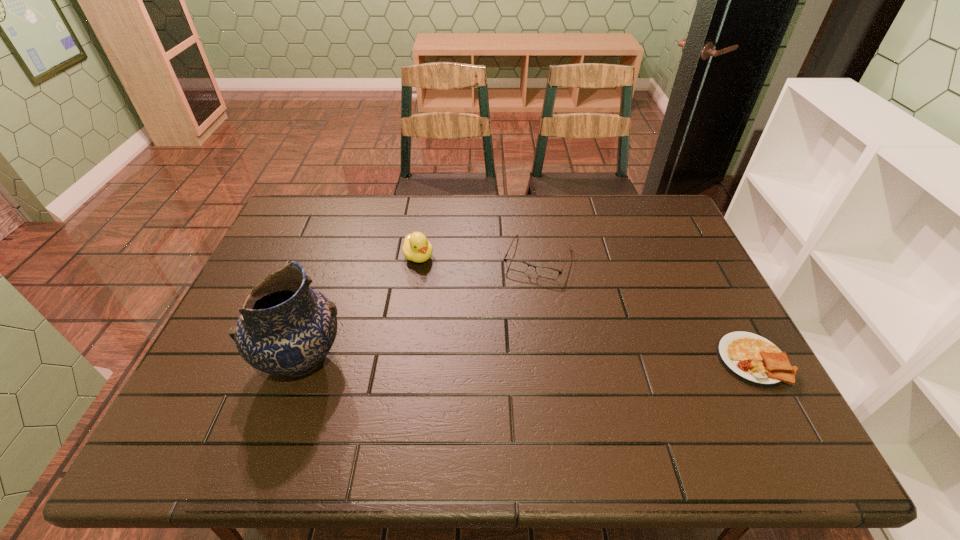
Where is `vacant space that is in between the duckling and the rightmost object`? This screenshot has width=960, height=540. vacant space that is in between the duckling and the rightmost object is located at coordinates (586, 308).

Where is `unoccupied area between the leftmost object and the rightmost object`? This screenshot has height=540, width=960. unoccupied area between the leftmost object and the rightmost object is located at coordinates (527, 360).

The width and height of the screenshot is (960, 540). What are the coordinates of `unoccupied area between the pottery and the second object from left to right` in the screenshot? It's located at (360, 308).

You are a GUI agent. You are given a task and a screenshot of the screen. Output one action in this format:
    pyautogui.click(x=<x>, y=<y>)
    Task: Click on the vacant space that is in between the omelet and the second object from left to right
    
    Given the screenshot: What is the action you would take?
    pyautogui.click(x=586, y=308)

Locate an element on the screen. Image resolution: width=960 pixels, height=540 pixels. free space between the omelet and the duckling is located at coordinates (586, 308).

This screenshot has width=960, height=540. I want to click on vacant area that lies between the rightmost object and the second object from right to left, so click(x=645, y=309).

I want to click on vacant region between the third object from right to left and the third object from left to right, so click(478, 257).

Locate an element on the screen. The width and height of the screenshot is (960, 540). object identified as the third closest to the third shortest object is located at coordinates (751, 358).

Identify which object is the nearest to the second object from right to left. Please provide its 2D coordinates. Your answer should be formatted as a tuple, i.e. [(x, y)], where the tuple contains the x and y coordinates of a point satisfying the conditions above.

[(416, 247)]

I want to click on blank space that satisfies the following two spatial constraints: 1. on the back side of the leftmost object; 2. on the left side of the third shortest object, so click(x=338, y=256).